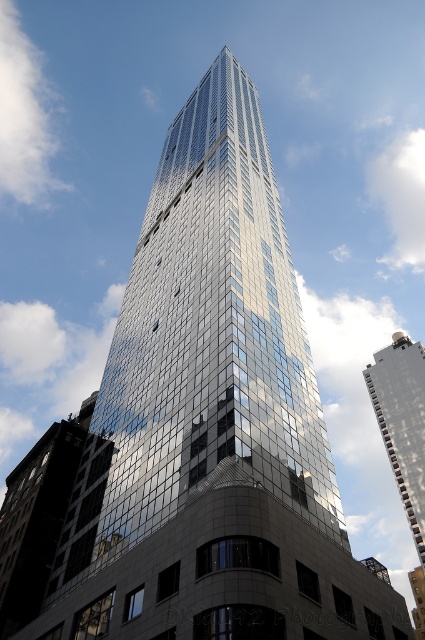
You are standing in front of the skyscraper and notice two points marked on the building. The first point is at coordinates point (x=45, y=433) and the second is at point (x=404, y=348). Which point is closer to you?

Point (x=45, y=433) is closer to you because it is further to the viewer than point (x=404, y=348).

Looking at this image, you are an architect reviewing a 3D model of a cityscape. You notice two glossy glass buildings in the design. The first is labeled as the glossy glass building at center, and the second is the glossy glass building at upper center. Based on their positions, which one appears taller when viewed from your perspective?

The glossy glass building at upper center appears taller than the glossy glass building at center because it is positioned higher up in the scene, making it seem larger despite their actual heights.